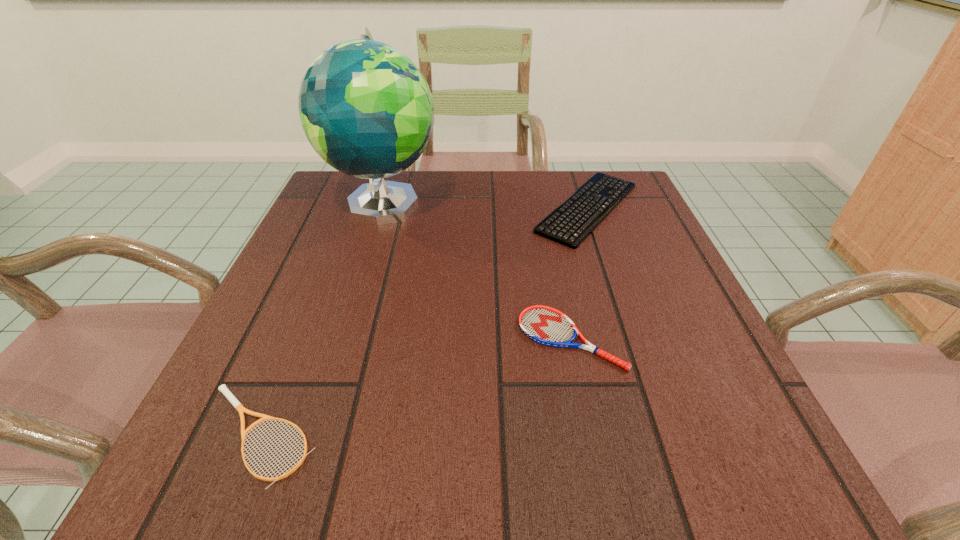
Identify the location of empty location between the shorter tennis racket and the computer keyboard. (423, 321).

At what (x,y) coordinates should I click in order to perform the action: click on vacant space in between the second nearest object and the computer keyboard. Please return your answer as a coordinate pair (x, y). The width and height of the screenshot is (960, 540). Looking at the image, I should click on (579, 273).

I want to click on blank region between the farther tennis racket and the computer keyboard, so click(x=579, y=273).

The height and width of the screenshot is (540, 960). I want to click on blank region between the tallest object and the farther tennis racket, so click(x=478, y=271).

The image size is (960, 540). I want to click on object that is the second closest to the farther tennis racket, so click(366, 109).

Locate an element on the screen. the third closest object to the computer keyboard is located at coordinates (238, 406).

The height and width of the screenshot is (540, 960). In order to click on free region that satisfies the following two spatial constraints: 1. on the front surface of the third farthest object; 2. on the left side of the tallest object in this screenshot , I will do `click(343, 339)`.

Locate an element on the screen. blank area in the image that satisfies the following two spatial constraints: 1. on the front surface of the farther tennis racket; 2. on the left side of the tallest object is located at coordinates (343, 339).

The height and width of the screenshot is (540, 960). In order to click on vacant point that satisfies the following two spatial constraints: 1. on the front surface of the globe; 2. on the left side of the third farthest object in this screenshot , I will do `click(343, 339)`.

At what (x,y) coordinates should I click in order to perform the action: click on free space that satisfies the following two spatial constraints: 1. on the back side of the computer keyboard; 2. on the right side of the farther tennis racket. Please return your answer as a coordinate pair (x, y). The image size is (960, 540). Looking at the image, I should click on (544, 208).